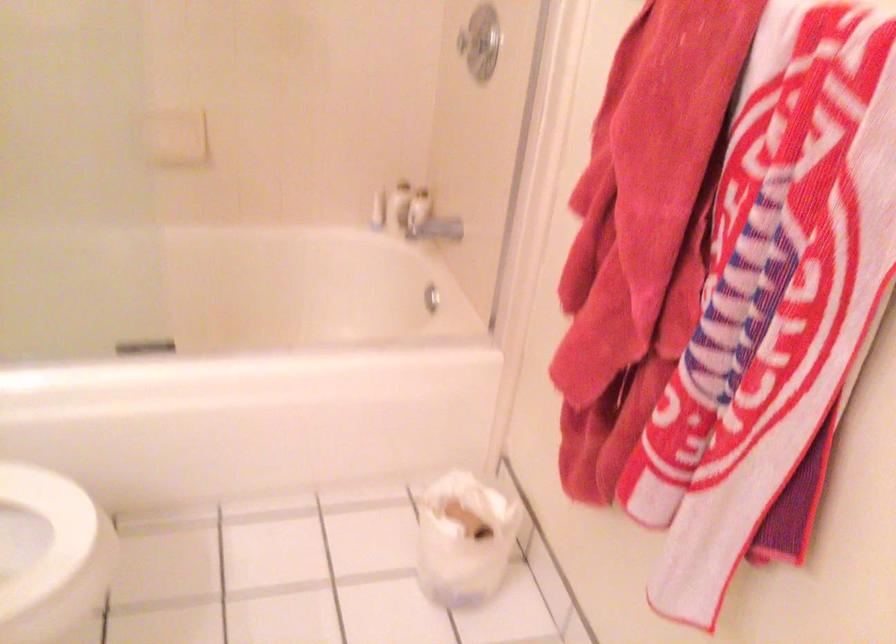
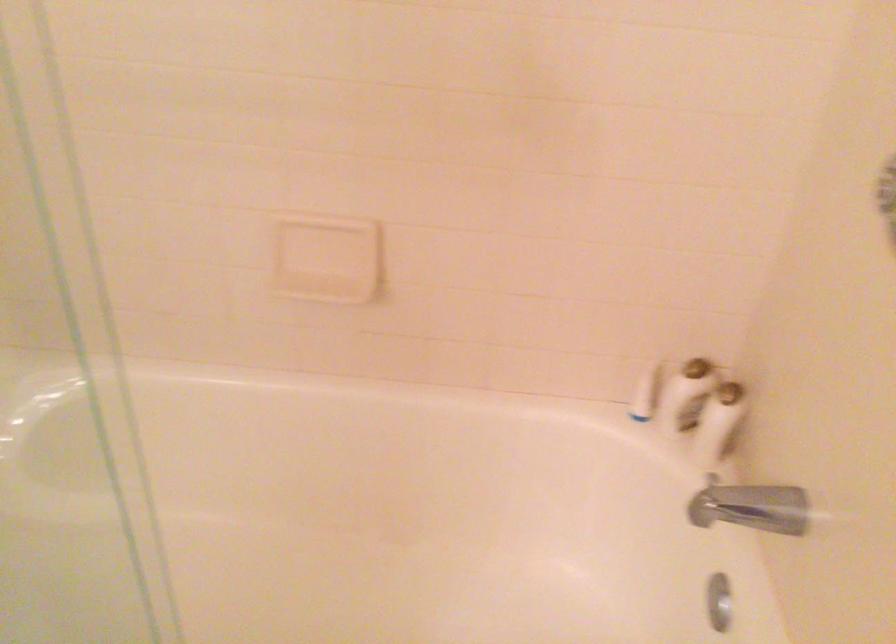
Where in the second image is the point corresponding to (x=419, y=207) from the first image?

(718, 422)